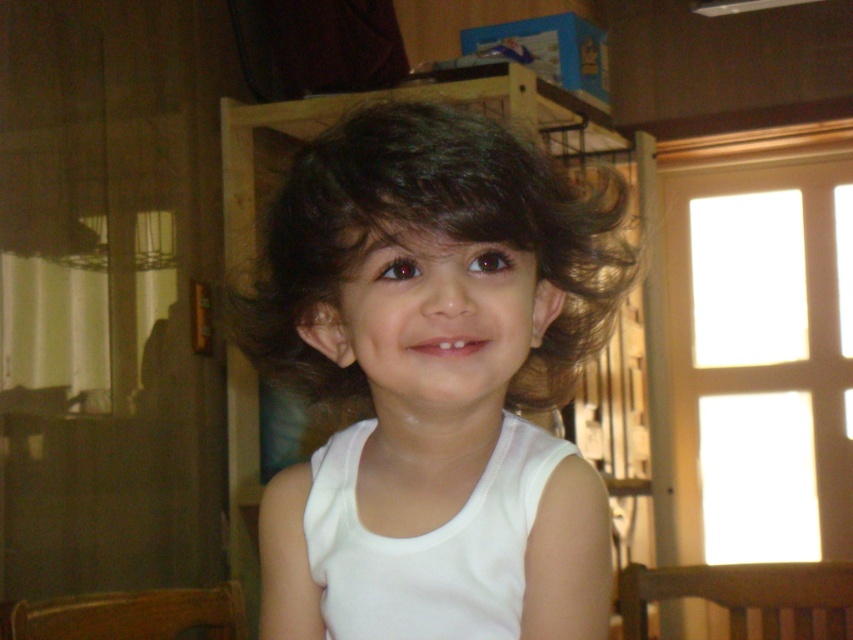
Question: Does white smooth tank top at center have a lesser width compared to white fabric tank top at center?

Choices:
 (A) no
 (B) yes

Answer: (A)

Question: Is white smooth tank top at center bigger than white fabric tank top at center?

Choices:
 (A) yes
 (B) no

Answer: (A)

Question: Among these points, which one is farthest from the camera?

Choices:
 (A) (445, 554)
 (B) (474, 166)

Answer: (A)

Question: From the image, what is the correct spatial relationship of white smooth tank top at center in relation to white fabric tank top at center?

Choices:
 (A) right
 (B) left

Answer: (A)